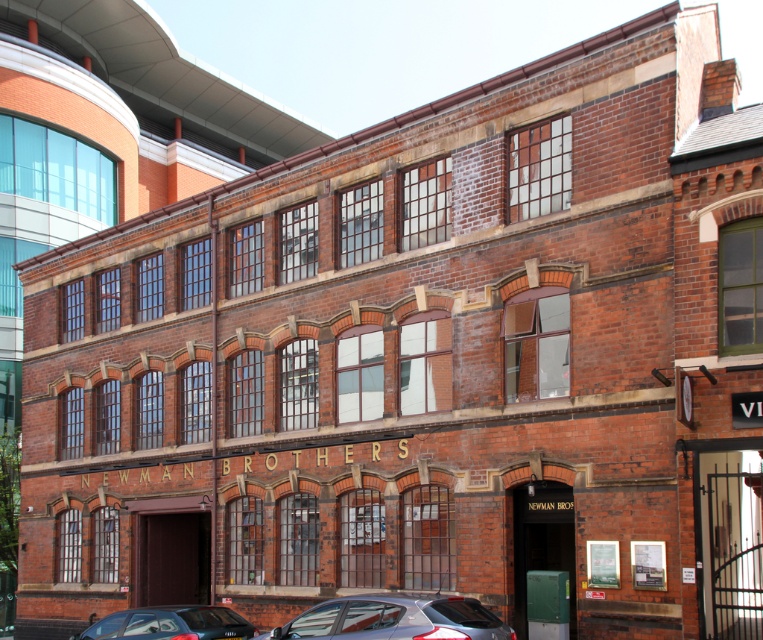
You are a delivery person who needs to park your truck in front of the Newman Brothers building. There are two cars blocking the entrance. Can you move the satin silver car at lower center without moving the shiny black car at lower left?

The satin silver car at lower center is positioned over shiny black car at lower left, so you cannot move the satin silver car at lower center without also moving the shiny black car at lower left.

You are a delivery driver who needs to park your truck between the satin silver car at lower center and the shiny black car at lower left. Your truck is 2.5 meters wide. Can you fit your truck in the space between them?

The satin silver car at lower center is thinner than the shiny black car at lower left, so the space between them is narrower than the width of the shiny black car. Since your truck is 2.5 meters wide, you need to check if the space between them is at least 2.5 meters. However, without specific measurements, it is uncertain if the space is wide enough for your truck.

From the picture: You are a delivery driver who needs to back out of the parking spot between the satin silver car at lower center and the shiny black car at lower left. Can you exit without moving either of them?

The satin silver car at lower center is in front of the shiny black car at lower left, so you can back out by moving backward since the shiny black car at lower left is behind the satin silver car at lower center and not blocking your exit.